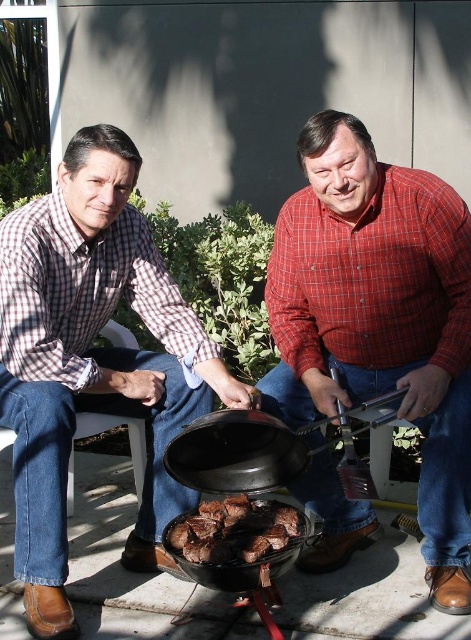
You are a photographer trying to capture the exact location of the red checkered shirt at center in the image. According to the coordinates provided, where would you focus your camera?

The red checkered shirt at center is located at coordinates point (380, 317).